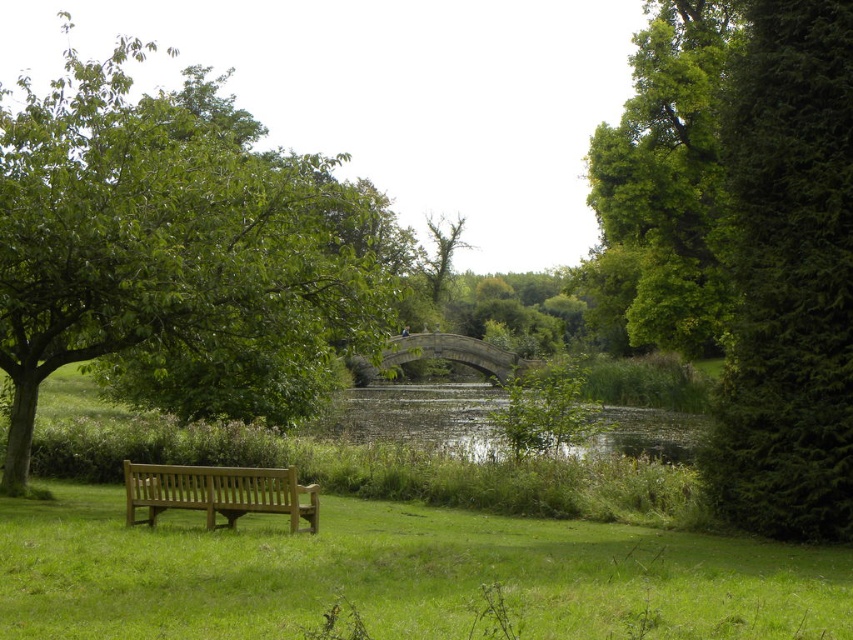
You are standing at the point marked by coordinates point (218, 492) in the park. What object are you standing on?

You are standing on the light brown wooden bench at lower left.

Looking at this image, you are planning to take a nap on the light brown wooden bench at lower left. Considering the green leafy tree at left is wider than the bench, will the tree provide enough shade to cover the entire bench?

The green leafy tree at left is wider than the light brown wooden bench at lower left, so the tree should provide enough shade to cover the entire bench.

You are standing at the wooden bench in the park. You want to walk to the green grass at lower left located at point (397,576). Is there a clear path between you and the green grass at lower left?

The green grass at lower left is located at point (397,576). Since there are no obstacles mentioned between the wooden bench and the green grass at lower left, you can assume there is a clear path.